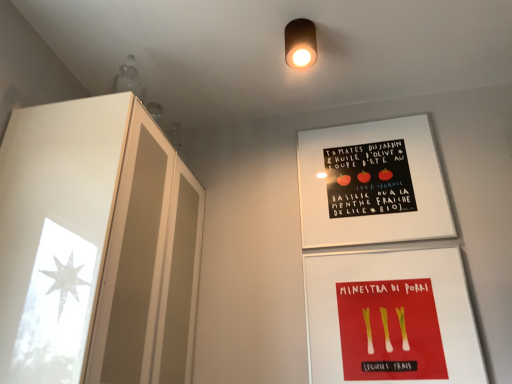
Find the location of a particular element. The image size is (512, 384). matte brown cylinder at upper center is located at coordinates (300, 44).

What is the approximate width of frosted glass cabinet at left?

The width of frosted glass cabinet at left is 16.96 inches.

This screenshot has width=512, height=384. What are the coordinates of `matte brown cylinder at upper center` in the screenshot? It's located at (300, 44).

From the image's perspective, which is below, red matte leeks at lower center or white matte poster at upper center?

From the image's view, red matte leeks at lower center is below.

The height and width of the screenshot is (384, 512). In order to click on bulletin board lying above the red matte leeks at lower center (from the image's perspective) in this screenshot , I will do `click(371, 184)`.

Is red matte leeks at lower center bigger than white matte poster at upper center?

No.

Considering the sizes of objects red matte leeks at lower center and white matte poster at upper center in the image provided, who is wider, red matte leeks at lower center or white matte poster at upper center?

white matte poster at upper center is wider.

Is frosted glass cabinet at left next to matte brown cylinder at upper center and touching it?

No, frosted glass cabinet at left is not with matte brown cylinder at upper center.

Considering the relative sizes of frosted glass cabinet at left and matte brown cylinder at upper center in the image provided, is frosted glass cabinet at left bigger than matte brown cylinder at upper center?

Indeed, frosted glass cabinet at left has a larger size compared to matte brown cylinder at upper center.

Is frosted glass cabinet at left in front of or behind matte brown cylinder at upper center in the image?

frosted glass cabinet at left is in front of matte brown cylinder at upper center.

Considering the relative sizes of frosted glass cabinet at left and matte brown cylinder at upper center in the image provided, is frosted glass cabinet at left taller than matte brown cylinder at upper center?

Yes, frosted glass cabinet at left is taller than matte brown cylinder at upper center.

From the image's perspective, which one is positioned lower, matte brown cylinder at upper center or frosted glass cabinet at left?

frosted glass cabinet at left, from the image's perspective.

Considering the positions of objects matte brown cylinder at upper center and frosted glass cabinet at left in the image provided, who is more to the right, matte brown cylinder at upper center or frosted glass cabinet at left?

matte brown cylinder at upper center is more to the right.

Does matte brown cylinder at upper center contain frosted glass cabinet at left?

That's incorrect, frosted glass cabinet at left is not inside matte brown cylinder at upper center.

Consider the image. Is matte brown cylinder at upper center bigger than frosted glass cabinet at left?

Actually, matte brown cylinder at upper center might be smaller than frosted glass cabinet at left.

Is matte brown cylinder at upper center further to the viewer compared to white matte poster at upper center?

No.

Measure the distance from matte brown cylinder at upper center to white matte poster at upper center.

matte brown cylinder at upper center is 19.40 inches away from white matte poster at upper center.

From the picture: Is matte brown cylinder at upper center at the left side of white matte poster at upper center?

Yes, matte brown cylinder at upper center is to the left of white matte poster at upper center.

Can you confirm if matte brown cylinder at upper center is wider than white matte poster at upper center?

Yes.

From the image's perspective, does red matte leeks at lower center appear lower than matte brown cylinder at upper center?

Yes, from the image's perspective, red matte leeks at lower center is below matte brown cylinder at upper center.

Which of these two, red matte leeks at lower center or matte brown cylinder at upper center, is smaller?

Smaller between the two is matte brown cylinder at upper center.

Can you confirm if red matte leeks at lower center is shorter than matte brown cylinder at upper center?

No.

Is frosted glass cabinet at left facing towards white matte poster at upper center?

Yes, frosted glass cabinet at left is turned towards white matte poster at upper center.

Is frosted glass cabinet at left not close to white matte poster at upper center?

frosted glass cabinet at left is actually quite close to white matte poster at upper center.

From a real-world perspective, is frosted glass cabinet at left positioned over white matte poster at upper center based on gravity?

No, from a real-world perspective, frosted glass cabinet at left is not over white matte poster at upper center

Which is more to the right, frosted glass cabinet at left or white matte poster at upper center?

white matte poster at upper center is more to the right.

Looking at this image, considering the positions of objects white matte poster at upper center and red matte leeks at lower center in the image provided, who is more to the right, white matte poster at upper center or red matte leeks at lower center?

Positioned to the right is red matte leeks at lower center.

How many degrees apart are the facing directions of white matte poster at upper center and red matte leeks at lower center?

0 degrees separate the facing orientations of white matte poster at upper center and red matte leeks at lower center.

Considering the sizes of white matte poster at upper center and red matte leeks at lower center in the image, is white matte poster at upper center taller or shorter than red matte leeks at lower center?

white matte poster at upper center is taller than red matte leeks at lower center.

Does point (317, 149) come in front of point (400, 283)?

No, (317, 149) is behind (400, 283).

I want to click on flyer located below the white matte poster at upper center (from the image's perspective), so click(391, 318).

The height and width of the screenshot is (384, 512). I want to click on glass door below the matte brown cylinder at upper center (from a real-world perspective), so click(x=149, y=266).

From the picture: Considering their positions, is frosted glass cabinet at left positioned further to red matte leeks at lower center than white matte poster at upper center?

frosted glass cabinet at left lies further to red matte leeks at lower center than the other object.

Which object lies further to the anchor point red matte leeks at lower center, white matte poster at upper center or frosted glass cabinet at left?

frosted glass cabinet at left.

Based on their spatial positions, is frosted glass cabinet at left or matte brown cylinder at upper center closer to red matte leeks at lower center?

frosted glass cabinet at left is positioned closer to the anchor red matte leeks at lower center.

Considering their positions, is frosted glass cabinet at left positioned further to white matte poster at upper center than red matte leeks at lower center?

frosted glass cabinet at left lies further to white matte poster at upper center than the other object.

When comparing their distances from red matte leeks at lower center, does matte brown cylinder at upper center or white matte poster at upper center seem further?

matte brown cylinder at upper center is further to red matte leeks at lower center.

From the image, which object appears to be farther from matte brown cylinder at upper center, frosted glass cabinet at left or red matte leeks at lower center?

Among the two, red matte leeks at lower center is located further to matte brown cylinder at upper center.

Based on their spatial positions, is frosted glass cabinet at left or matte brown cylinder at upper center closer to white matte poster at upper center?

matte brown cylinder at upper center lies closer to white matte poster at upper center than the other object.

Which object lies nearer to the anchor point matte brown cylinder at upper center, frosted glass cabinet at left or white matte poster at upper center?

white matte poster at upper center.

Find the location of a particular element. The height and width of the screenshot is (384, 512). light fixture between frosted glass cabinet at left and white matte poster at upper center from left to right is located at coordinates (300, 44).

You are a GUI agent. You are given a task and a screenshot of the screen. Output one action in this format:
    pyautogui.click(x=<x>, y=<y>)
    Task: Click on the bulletin board between matte brown cylinder at upper center and red matte leeks at lower center from top to bottom
    Image resolution: width=512 pixels, height=384 pixels.
    Given the screenshot: What is the action you would take?
    pyautogui.click(x=371, y=184)

Image resolution: width=512 pixels, height=384 pixels. I want to click on glass door between matte brown cylinder at upper center and red matte leeks at lower center in the up-down direction, so click(x=149, y=266).

At what (x,y) coordinates should I click in order to perform the action: click on bulletin board located between frosted glass cabinet at left and red matte leeks at lower center in the left-right direction. Please return your answer as a coordinate pair (x, y). Looking at the image, I should click on (371, 184).